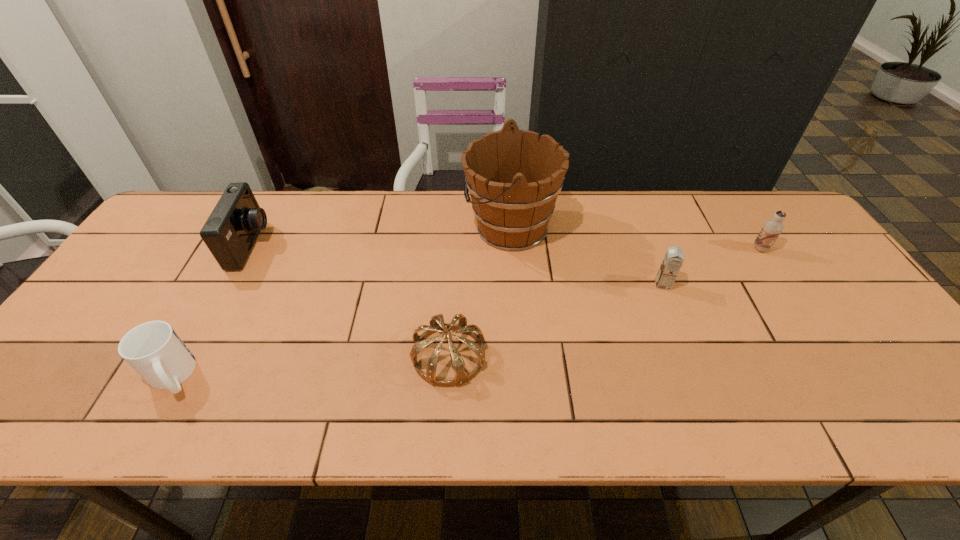
This screenshot has width=960, height=540. What are the coordinates of `wine bucket` in the screenshot? It's located at (513, 178).

Identify the location of camera. (230, 232).

Identify the location of the right chocolate milk. Image resolution: width=960 pixels, height=540 pixels. coord(772,228).

The height and width of the screenshot is (540, 960). Identify the location of the farther chocolate milk. (772, 228).

Identify the location of the left chocolate milk. Image resolution: width=960 pixels, height=540 pixels. (674, 257).

Locate an element on the screen. the nearer chocolate milk is located at coordinates (674, 257).

Find the location of a particular element. The image size is (960, 540). mug is located at coordinates (153, 349).

Where is `tiara`? This screenshot has height=540, width=960. tiara is located at coordinates (437, 324).

Where is `blank space located 0.100m with the handle on the tallest object`? blank space located 0.100m with the handle on the tallest object is located at coordinates (431, 227).

Find the location of `vacant area situated with the handle on the tallest object`. vacant area situated with the handle on the tallest object is located at coordinates (372, 227).